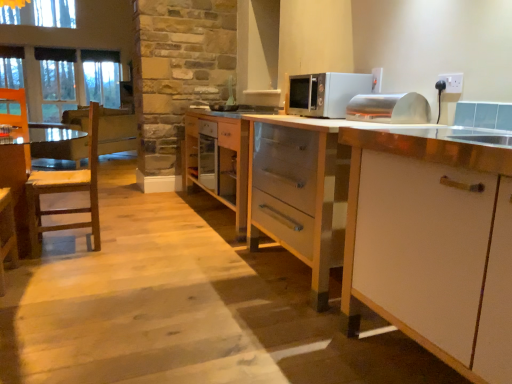
Question: Is white matte cabinet at right, which appears as the third cabinetry when viewed from the back, further to camera compared to clear glass window at upper left?

Choices:
 (A) yes
 (B) no

Answer: (B)

Question: Is white matte cabinet at right, which appears as the third cabinetry when viewed from the back, facing towards clear glass window at upper left?

Choices:
 (A) yes
 (B) no

Answer: (B)

Question: From the image's perspective, is white matte cabinet at right, which appears as the third cabinetry when viewed from the back, located beneath clear glass window at upper left?

Choices:
 (A) yes
 (B) no

Answer: (A)

Question: Considering the relative positions of white matte cabinet at right, which ranks as the 1th cabinetry in front-to-back order, and clear glass window at upper left in the image provided, is white matte cabinet at right, which ranks as the 1th cabinetry in front-to-back order, in front of clear glass window at upper left?

Choices:
 (A) no
 (B) yes

Answer: (B)

Question: Can you confirm if white matte cabinet at right, which ranks as the 1th cabinetry in front-to-back order, is positioned to the left of clear glass window at upper left?

Choices:
 (A) yes
 (B) no

Answer: (B)

Question: Is white matte cabinet at right, which ranks as the 1th cabinetry in front-to-back order, positioned with its back to clear glass window at upper left?

Choices:
 (A) no
 (B) yes

Answer: (A)

Question: From a real-world perspective, is wooden chair at left positioned over clear glass window at upper left based on gravity?

Choices:
 (A) yes
 (B) no

Answer: (B)

Question: Can you confirm if wooden chair at left is positioned to the right of clear glass window at upper left?

Choices:
 (A) no
 (B) yes

Answer: (B)

Question: Can you confirm if wooden chair at left is smaller than clear glass window at upper left?

Choices:
 (A) yes
 (B) no

Answer: (A)

Question: Does wooden chair at left have a lesser height compared to clear glass window at upper left?

Choices:
 (A) yes
 (B) no

Answer: (A)

Question: From the image's perspective, is wooden chair at left over clear glass window at upper left?

Choices:
 (A) yes
 (B) no

Answer: (B)

Question: Considering the relative sizes of wooden chair at left and clear glass window at upper left in the image provided, is wooden chair at left bigger than clear glass window at upper left?

Choices:
 (A) no
 (B) yes

Answer: (A)

Question: Is white plastic electric outlet at upper right looking in the opposite direction of clear glass window at upper left?

Choices:
 (A) no
 (B) yes

Answer: (A)